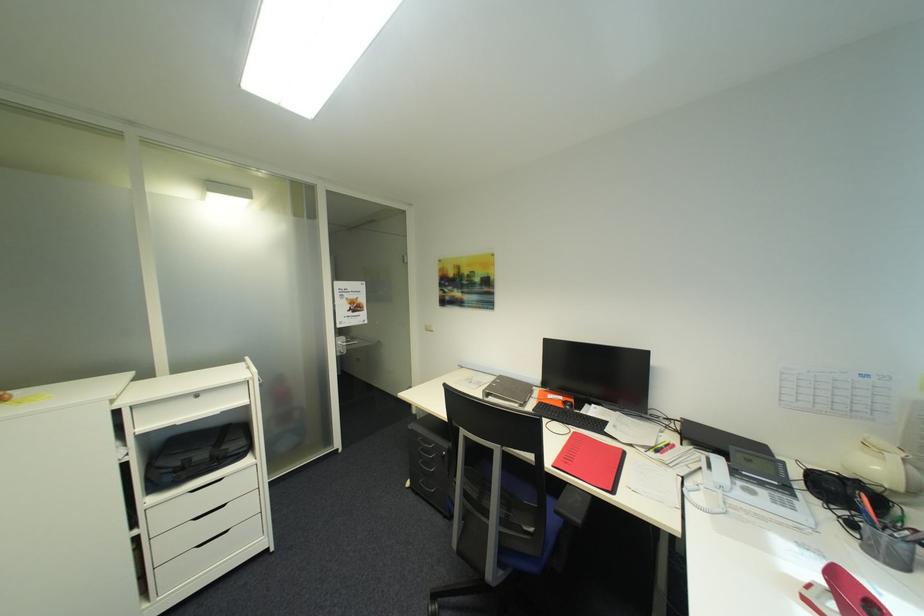
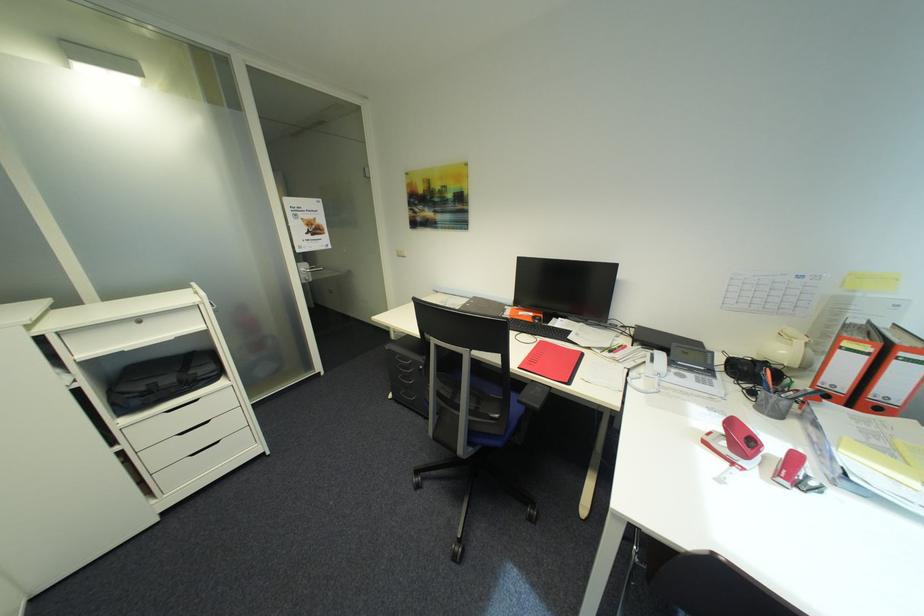
Find the pixel in the second image that matches point 558,504 in the first image.

(523, 395)